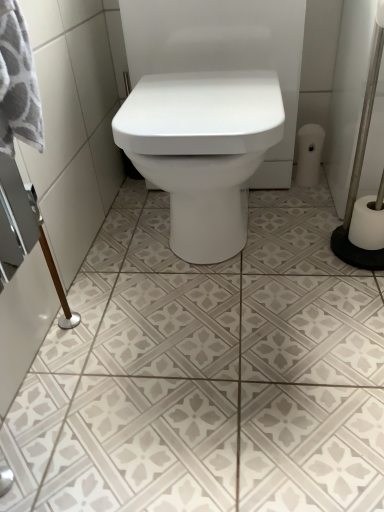
Locate an element on the screen. The width and height of the screenshot is (384, 512). free space to the left of white matte toilet paper at right, which is counted as the 1th toilet paper, starting from the top is located at coordinates (268, 197).